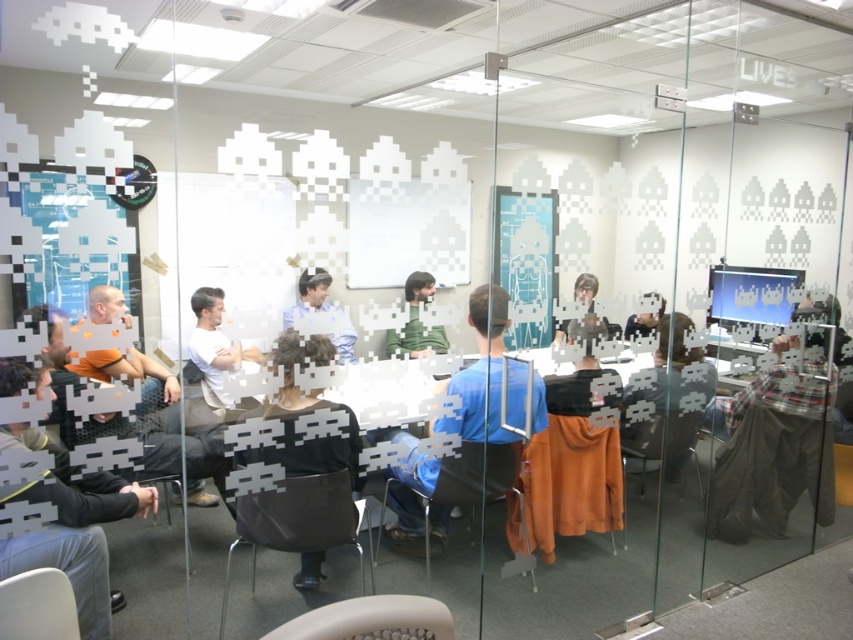
You are standing in the conference room and want to locate the blue fabric shirt at center. Where is it positioned in terms of coordinates?

The blue fabric shirt at center is located at coordinates point (x=480, y=372).

You are standing in the conference room and want to place a small plant on the table. The dark gray jeans at lower left and the orange fabric at center are on the table. Where should you place the plant so it is not under any objects?

You should place the plant on the table away from the dark gray jeans at lower left and orange fabric at center since the dark gray jeans at lower left is positioned under orange fabric at center, meaning both are occupying space on the table and placing the plant elsewhere would avoid it being under any objects.

You are a person sitting at the table in the conference room. You need to reach for the matte black laptop at center but there are dark gray jeans at lower left in the way. Can you move your hand around the jeans to access the laptop?

The dark gray jeans at lower left is positioned on the left side of the matte black laptop at center, so you can move your hand around the jeans to the right to access the laptop.